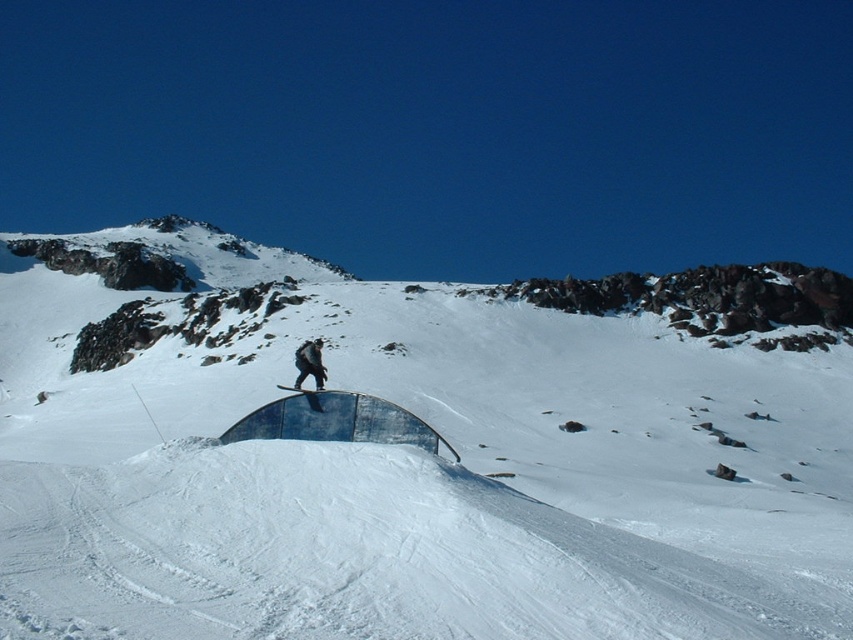
You are navigating a drone through the snowy mountain landscape shown in the image. There are two points marked on your map at coordinates point (550, 554) and point (306, 390). Your goal is to fly the drone from the starting point to the destination point. Which coordinate should you set as your starting point and which as your destination to ensure you fly towards the mountain background?

Point (550, 554) should be the starting point and point (306, 390) the destination because point (550, 554) is in front of point (306, 390), meaning flying from the former to the latter moves towards the mountain background.

You are a photographer trying to capture both the blue wooden snowboard at center and the black matte snowboard at center in a single shot. Which snowboard should you focus on first if you want to ensure both are in frame and properly aligned?

The blue wooden snowboard at center is positioned on the left side of the black matte snowboard at center. To ensure both are in frame and aligned, focus on the blue wooden snowboard at center first, then adjust to include the black matte snowboard at center on the right side.